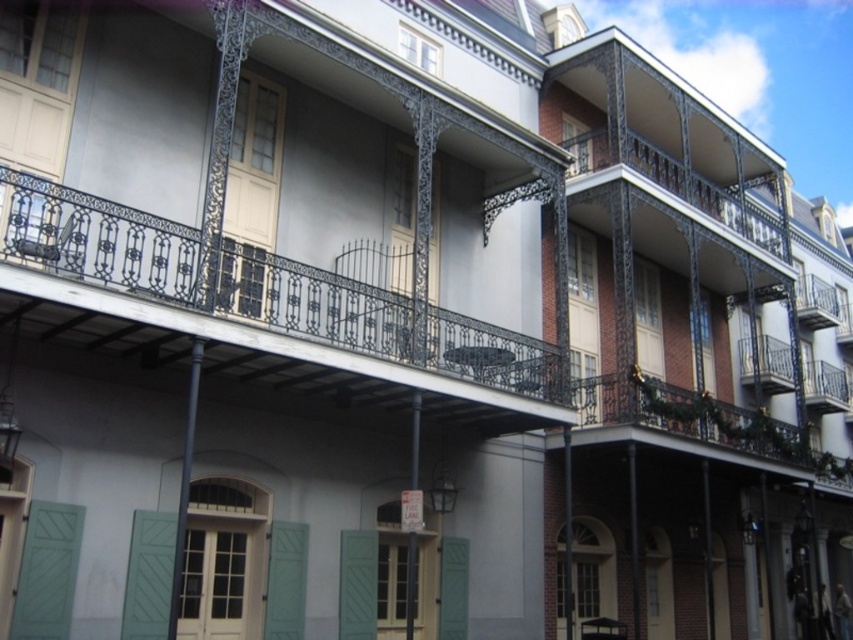
Question: Does black wrought iron balcony at center have a lesser width compared to green matte shutter at center?

Choices:
 (A) yes
 (B) no

Answer: (B)

Question: Among these points, which one is nearest to the camera?

Choices:
 (A) (167, 252)
 (B) (262, 204)

Answer: (A)

Question: Is black wrought iron balcony at center wider than green matte shutter at center?

Choices:
 (A) yes
 (B) no

Answer: (A)

Question: Does black wrought iron balcony at center appear on the right side of green matte shutter at center?

Choices:
 (A) yes
 (B) no

Answer: (A)

Question: Which of the following is the closest to the observer?

Choices:
 (A) green matte shutter at center
 (B) black wrought iron balcony at center

Answer: (B)